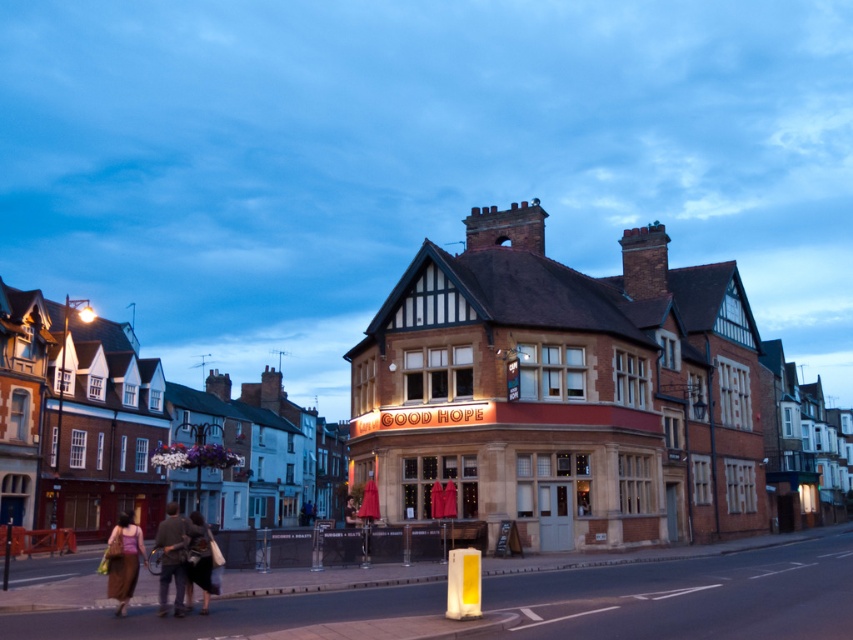
You are a delivery person standing at the entrance of the Good Hope pub. You need to deliver a package to the person wearing a brown leather jacket at lower left and another to the person wearing a brown textured dress at lower left. How far apart are the two recipients?

The brown leather jacket at lower left and the brown textured dress at lower left are 4.24 meters apart.

You are a photographer standing in front of the Good Hope pub. You notice two items at the lower left of your frame. Which item is closer to the camera, the brown leather jacket at lower left or the brown textured dress at lower left?

The brown leather jacket at lower left is positioned over the brown textured dress at lower left, so the brown leather jacket at lower left is closer to the camera.

You are a photographer trying to capture the Good Hope pub at twilight. You notice two people wearing a brown leather jacket at lower left and a brown textured dress at lower left. Which clothing item is positioned to the right of the other?

The brown leather jacket at lower left is positioned on the right side of brown textured dress at lower left.